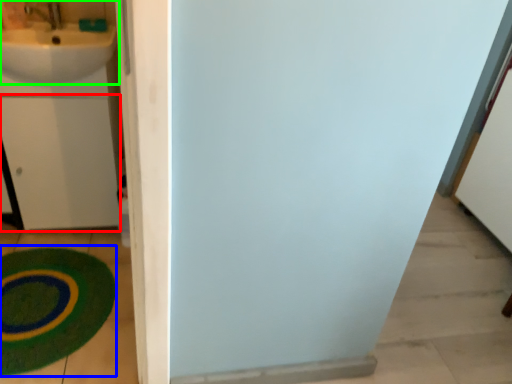
Question: Which object is the closest to the drawer (highlighted by a red box)? Choose among these: bath mat (highlighted by a blue box) or sink (highlighted by a green box).

Choices:
 (A) bath mat
 (B) sink

Answer: (B)